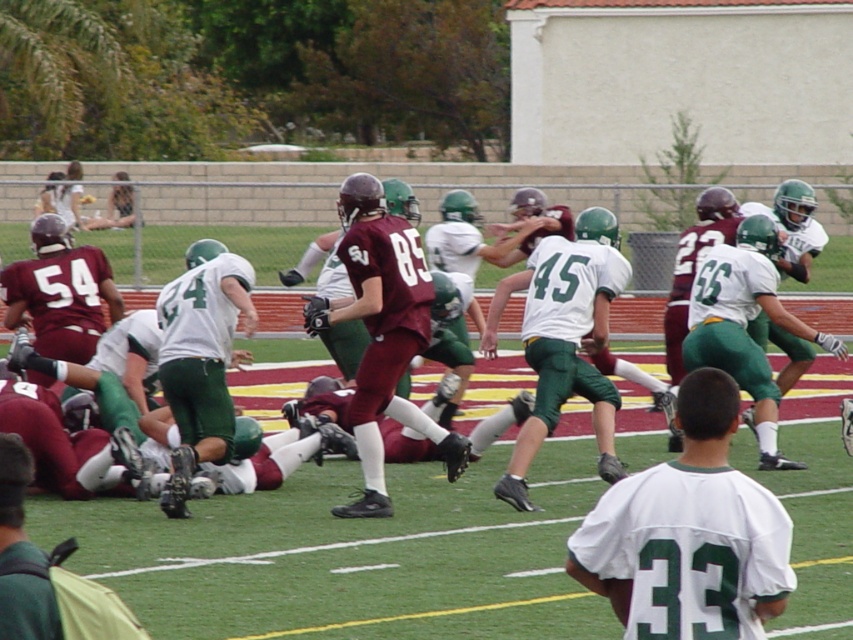
Based on the photo, you are a spectator at the football game and want to take a photo of both the white matte jersey at center and the white jersey at center. Which one will appear larger in your photo?

The white matte jersey at center will appear larger in your photo because it is closer to the viewer than the white jersey at center.